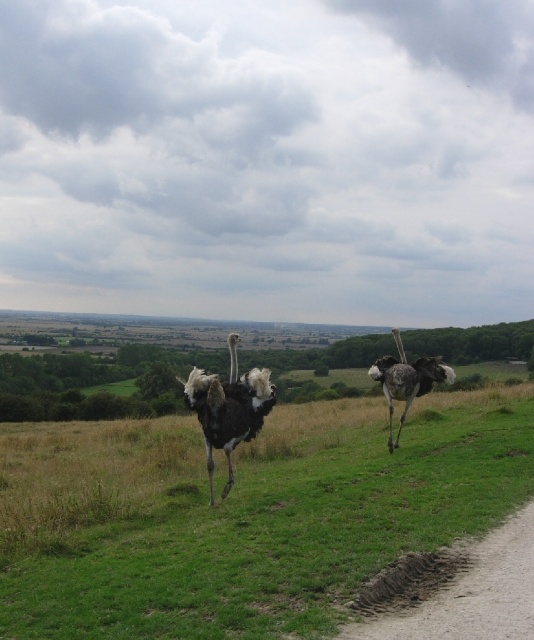
Question: Can you confirm if green grassy at center is positioned to the left of dirt/gravel path at lower right?

Choices:
 (A) no
 (B) yes

Answer: (B)

Question: Does black feathered ostrich at center appear on the left side of dark grey feathered ostrich at right?

Choices:
 (A) yes
 (B) no

Answer: (A)

Question: Which point is farther to the camera?

Choices:
 (A) dirt/gravel path at lower right
 (B) dark grey feathered ostrich at right
 (C) black feathered ostrich at center

Answer: (B)

Question: In this image, where is green grassy at center located relative to dirt/gravel path at lower right?

Choices:
 (A) left
 (B) right

Answer: (A)

Question: Considering the real-world distances, which object is farthest from the green grassy at center?

Choices:
 (A) dirt/gravel path at lower right
 (B) dark grey feathered ostrich at right
 (C) black feathered ostrich at center

Answer: (C)

Question: Which point is farther to the camera?

Choices:
 (A) dirt/gravel path at lower right
 (B) green grassy at center

Answer: (B)